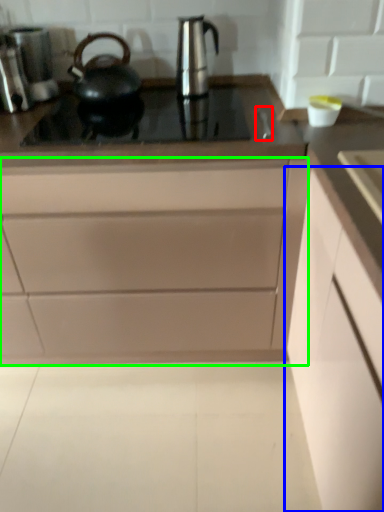
Question: Estimate the real-world distances between objects in this image. Which object is farther from faucet (highlighted by a red box), cabinetry (highlighted by a blue box) or cabinetry (highlighted by a green box)?

Choices:
 (A) cabinetry
 (B) cabinetry

Answer: (B)